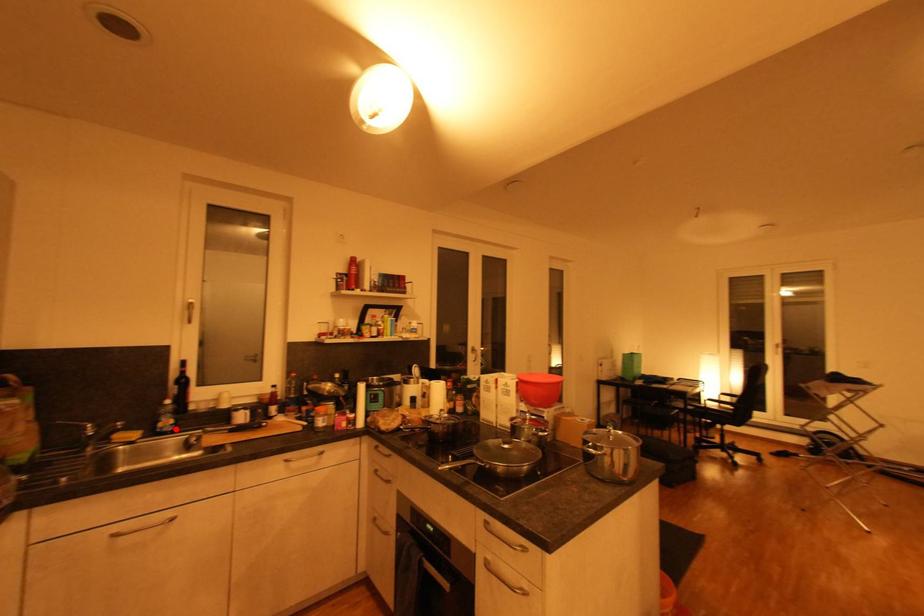
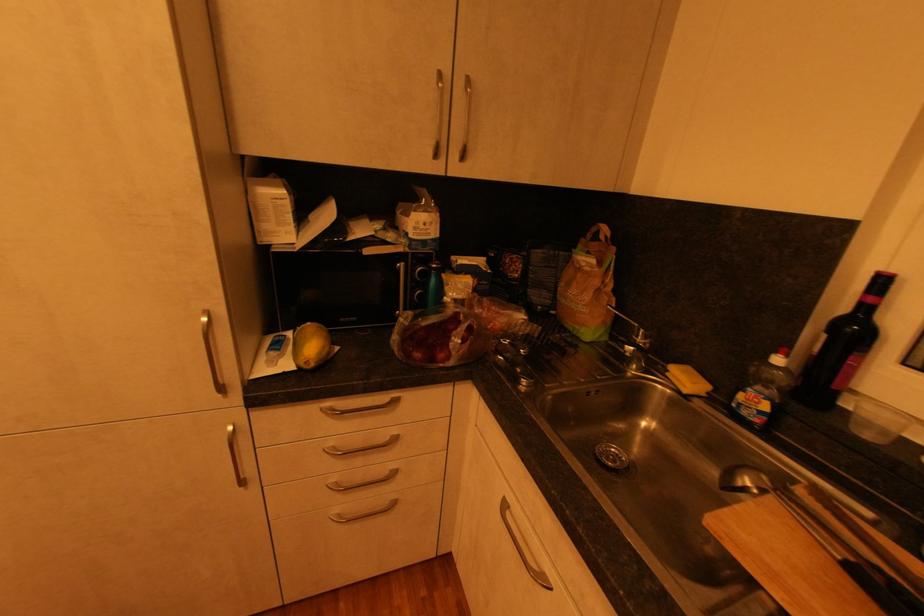
The point at the highlighted location is marked in the first image. Where is the corresponding point in the second image?

(760, 419)